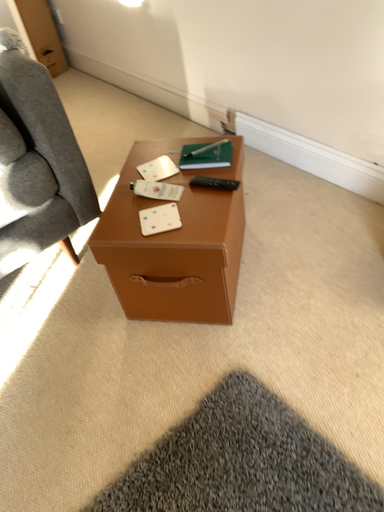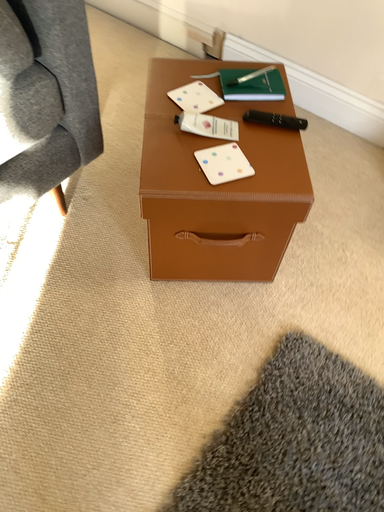
Question: Which way did the camera rotate in the video?

Choices:
 (A) rotated upward
 (B) rotated downward

Answer: (B)